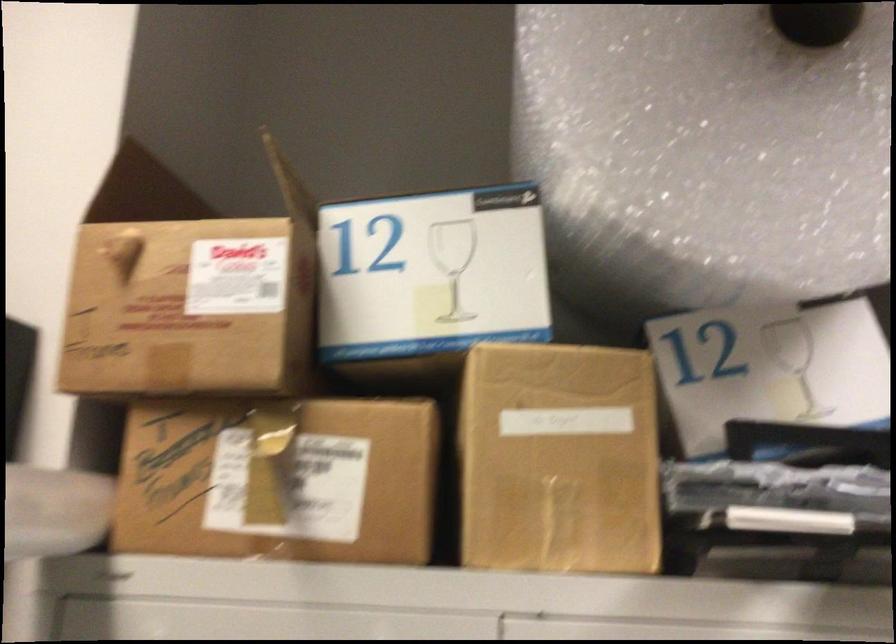
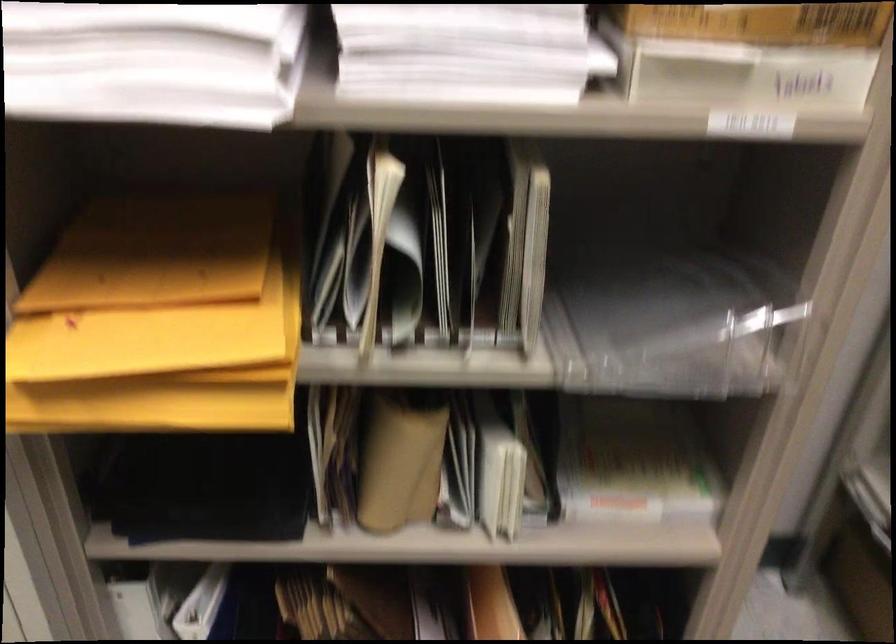
Question: In a continuous first-person perspective shot, in which direction is the camera moving?

Choices:
 (A) Left
 (B) Right
 (C) Forward
 (D) Backward

Answer: (D)